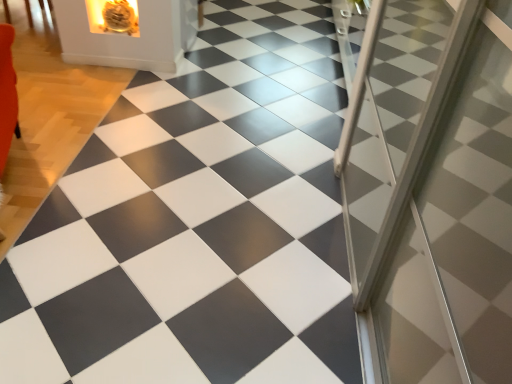
Describe the element at coordinates (391, 116) in the screenshot. I see `clear glass screen door at right` at that location.

The width and height of the screenshot is (512, 384). I want to click on clear glass screen door at right, so click(391, 116).

Identify the location of gold metallic fireplace at upper left. (113, 16).

Image resolution: width=512 pixels, height=384 pixels. What do you see at coordinates (113, 16) in the screenshot? I see `gold metallic fireplace at upper left` at bounding box center [113, 16].

Measure the distance between gold metallic fireplace at upper left and camera.

gold metallic fireplace at upper left and camera are 2.85 meters apart from each other.

I want to click on clear glass screen door at right, so click(x=391, y=116).

Which is more to the left, clear glass screen door at right or gold metallic fireplace at upper left?

From the viewer's perspective, gold metallic fireplace at upper left appears more on the left side.

Which object is further away from the camera taking this photo, clear glass screen door at right or gold metallic fireplace at upper left?

Positioned behind is gold metallic fireplace at upper left.

Looking at this image, which point is more distant from viewer, (465, 45) or (131, 20)?

Positioned behind is point (131, 20).

From the image's perspective, between clear glass screen door at right and gold metallic fireplace at upper left, which one is located above?

gold metallic fireplace at upper left is shown above in the image.

From a real-world perspective, is clear glass screen door at right above or below gold metallic fireplace at upper left?

clear glass screen door at right is situated higher than gold metallic fireplace at upper left in the real world.

Does clear glass screen door at right have a lesser width compared to gold metallic fireplace at upper left?

No, clear glass screen door at right is not thinner than gold metallic fireplace at upper left.

Who is taller, clear glass screen door at right or gold metallic fireplace at upper left?

Standing taller between the two is clear glass screen door at right.

Who is smaller, clear glass screen door at right or gold metallic fireplace at upper left?

Smaller between the two is gold metallic fireplace at upper left.

Is clear glass screen door at right positioned beyond the bounds of gold metallic fireplace at upper left?

clear glass screen door at right lies outside gold metallic fireplace at upper left's area.

Looking at this image, are clear glass screen door at right and gold metallic fireplace at upper left beside each other?

No, clear glass screen door at right is not making contact with gold metallic fireplace at upper left.

Is clear glass screen door at right oriented towards gold metallic fireplace at upper left?

No, clear glass screen door at right is not turned towards gold metallic fireplace at upper left.

What's the angular difference between clear glass screen door at right and gold metallic fireplace at upper left's facing directions?

clear glass screen door at right and gold metallic fireplace at upper left are facing 90.5 degrees away from each other.

The width and height of the screenshot is (512, 384). I want to click on fireplace located behind the clear glass screen door at right, so click(x=113, y=16).

Can you confirm if gold metallic fireplace at upper left is positioned to the left of clear glass screen door at right?

Yes, gold metallic fireplace at upper left is to the left of clear glass screen door at right.

Is gold metallic fireplace at upper left closer to camera compared to clear glass screen door at right?

No, gold metallic fireplace at upper left is further to the viewer.

Is point (103, 23) farther from viewer compared to point (407, 34)?

Yes, point (103, 23) is farther from viewer.

From the image's perspective, is gold metallic fireplace at upper left above or below clear glass screen door at right?

From the image's perspective, gold metallic fireplace at upper left appears above clear glass screen door at right.

From the picture: From a real-world perspective, between gold metallic fireplace at upper left and clear glass screen door at right, who is vertically higher?

clear glass screen door at right, from a real-world perspective.

Does gold metallic fireplace at upper left have a greater width compared to clear glass screen door at right?

In fact, gold metallic fireplace at upper left might be narrower than clear glass screen door at right.

Which of these two, gold metallic fireplace at upper left or clear glass screen door at right, stands shorter?

gold metallic fireplace at upper left is shorter.

Is gold metallic fireplace at upper left bigger than clear glass screen door at right?

Incorrect, gold metallic fireplace at upper left is not larger than clear glass screen door at right.

Can we say gold metallic fireplace at upper left lies outside clear glass screen door at right?

Indeed, gold metallic fireplace at upper left is completely outside clear glass screen door at right.

Is gold metallic fireplace at upper left with clear glass screen door at right?

No, gold metallic fireplace at upper left is not beside clear glass screen door at right.

Is gold metallic fireplace at upper left facing towards clear glass screen door at right?

No, gold metallic fireplace at upper left is not facing towards clear glass screen door at right.

At what (x,y) coordinates should I click in order to perform the action: click on screen door positioned vertically above the gold metallic fireplace at upper left (from a real-world perspective). Please return your answer as a coordinate pair (x, y). This screenshot has width=512, height=384. Looking at the image, I should click on (391, 116).

Image resolution: width=512 pixels, height=384 pixels. Find the location of `fireplace that appears behind the clear glass screen door at right`. fireplace that appears behind the clear glass screen door at right is located at coordinates (113, 16).

The image size is (512, 384). I want to click on screen door in front of the gold metallic fireplace at upper left, so click(x=391, y=116).